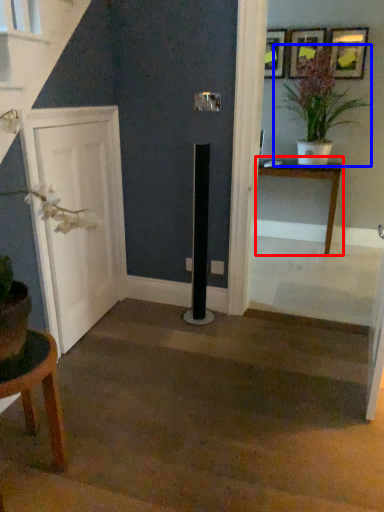
Question: Which of the following is the farthest to the observer, table (highlighted by a red box) or houseplant (highlighted by a blue box)?

Choices:
 (A) table
 (B) houseplant

Answer: (A)